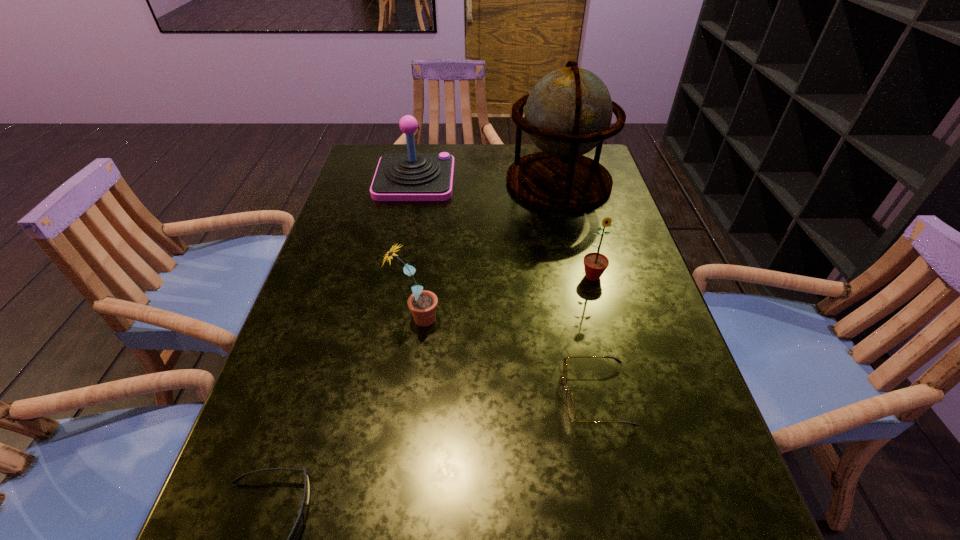
I want to click on vacant area between the joystick and the tallest object, so point(487,180).

The height and width of the screenshot is (540, 960). In order to click on vacant space that's between the nearer sunflower and the tallest object in this screenshot , I will do `click(488, 251)`.

Locate which object is the fourth closest to the globe. Please provide its 2D coordinates. Your answer should be formatted as a tuple, i.e. [(x, y)], where the tuple contains the x and y coordinates of a point satisfying the conditions above.

[(570, 403)]

At what (x,y) coordinates should I click in order to perform the action: click on object that is the fifth closest to the third farthest object. Please return your answer as a coordinate pair (x, y). The width and height of the screenshot is (960, 540). Looking at the image, I should click on (x=292, y=539).

Image resolution: width=960 pixels, height=540 pixels. I want to click on vacant space that satisfies the following two spatial constraints: 1. on the face of the right sunflower; 2. on the flower of the third nearest object, so click(604, 319).

You are a GUI agent. You are given a task and a screenshot of the screen. Output one action in this format:
    pyautogui.click(x=<x>, y=<y>)
    Task: Click on the vacant area that satisfies the following two spatial constraints: 1. on the front-facing side of the globe; 2. on the flower of the nearer sunflower
    This screenshot has height=540, width=960.
    Given the screenshot: What is the action you would take?
    pyautogui.click(x=590, y=319)